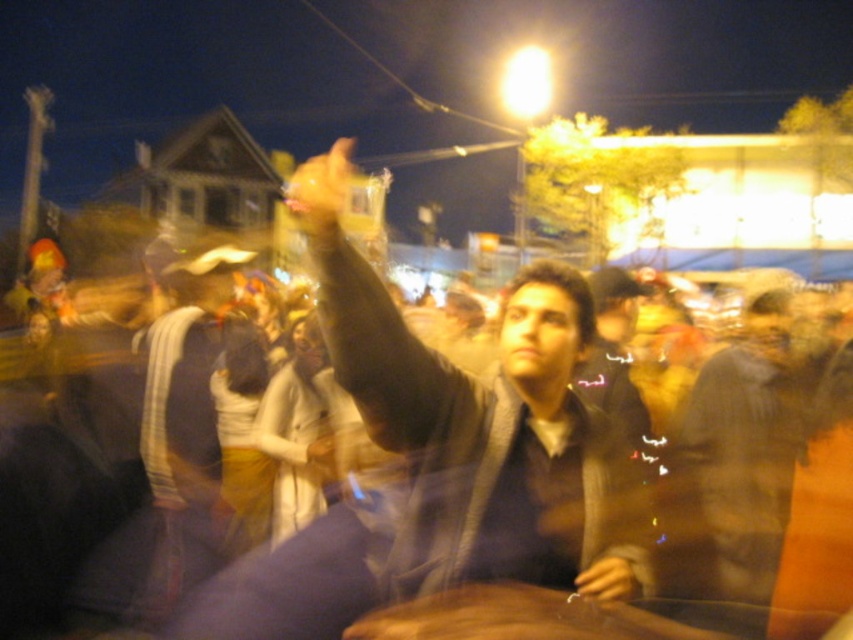
Question: Does matte black jacket at center come behind smooth yellowish hand at center?

Choices:
 (A) yes
 (B) no

Answer: (A)

Question: Does yellow rubber glove at upper center have a lesser width compared to smooth yellowish hand at center?

Choices:
 (A) no
 (B) yes

Answer: (A)

Question: Can you confirm if yellow rubber glove at upper center is positioned above smooth yellowish hand at center?

Choices:
 (A) no
 (B) yes

Answer: (B)

Question: Based on their relative distances, which object is farther from the matte black jacket at center?

Choices:
 (A) yellow rubber glove at upper center
 (B) smooth yellowish hand at center

Answer: (A)

Question: Among these points, which one is nearest to the camera?

Choices:
 (A) (335, 220)
 (B) (625, 566)
 (C) (33, 513)

Answer: (A)

Question: Among these objects, which one is farthest from the camera?

Choices:
 (A) smooth yellowish hand at center
 (B) yellow rubber glove at upper center
 (C) matte black jacket at center
 (D) brown leather jacket at center

Answer: (D)